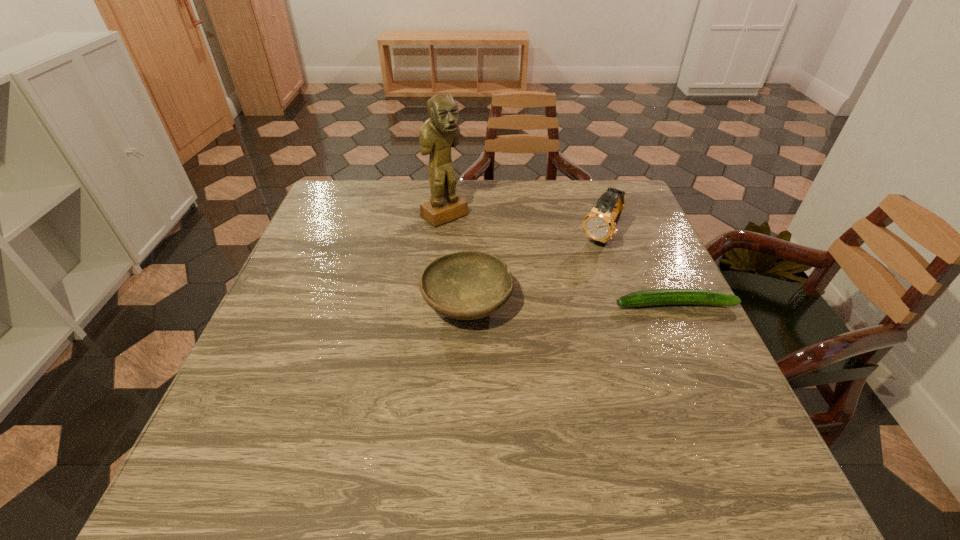
Where is `vacant space at the far left corner`? vacant space at the far left corner is located at coordinates (363, 184).

Where is `vacant space that is in between the second tallest object and the bowl`? The image size is (960, 540). vacant space that is in between the second tallest object and the bowl is located at coordinates (534, 271).

Where is `free area in between the zucchini and the third shortest object`? free area in between the zucchini and the third shortest object is located at coordinates (637, 271).

Locate an element on the screen. unoccupied area between the second tallest object and the third tallest object is located at coordinates (534, 271).

Identify the location of free space between the watch and the figurine. The image size is (960, 540). (522, 226).

Where is `blank region between the third tallest object and the watch`? blank region between the third tallest object and the watch is located at coordinates (534, 271).

I want to click on free space between the third shortest object and the figurine, so click(522, 226).

Locate an element on the screen. free point between the tallest object and the shortest object is located at coordinates (560, 260).

The height and width of the screenshot is (540, 960). Identify the location of free space between the tallest object and the zucchini. (560, 260).

At what (x,y) coordinates should I click in order to perform the action: click on the third closest object relative to the shortest object. Please return your answer as a coordinate pair (x, y). Looking at the image, I should click on (441, 131).